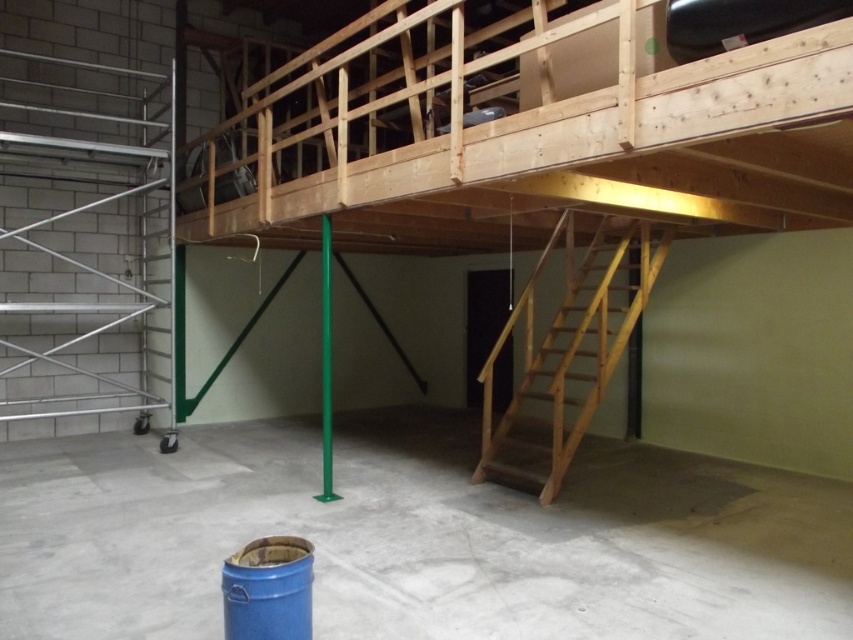
You are standing at the base of the wooden staircase leading to the mezzanine in the construction site. You need to reach a point that is exactly 14.81 feet away from where you are currently standing. Can you confirm if the point at coordinates point (369,570) is the correct location to reach?

Yes, the point at coordinates point (369,570) is exactly 14.81 feet away from your current position at the base of the wooden staircase, so it is the correct location to reach.

You are a construction worker carrying a large tool box. You need to move from the blue plastic barrel at lower left to the natural wood staircase at lower right. Is there enough space to walk between them?

The blue plastic barrel at lower left occupies less space than natural wood staircase at lower right, so there is enough space to walk between them.

You are a construction worker standing at the center of the room. You need to place a new tool box at point (x=416, y=538). Is there already an object at that location?

Yes, there is a blue plastic barrel at lower left located at point (x=416, y=538), so placing the tool box there would require moving the existing barrel.